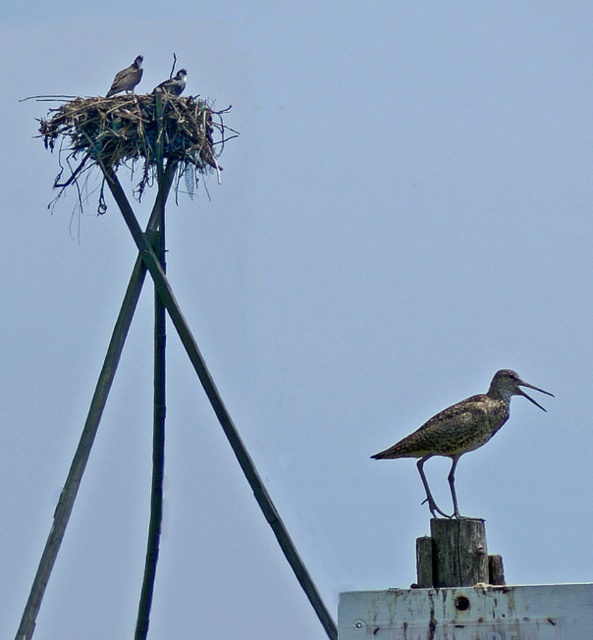
Can you confirm if speckled feathered bird at center is thinner than dark gray feathers at upper left?

Incorrect, speckled feathered bird at center's width is not less than dark gray feathers at upper left's.

Does point (419, 448) come behind point (178, 80)?

That is False.

Where is `speckled feathered bird at center`? This screenshot has width=593, height=640. speckled feathered bird at center is located at coordinates (460, 429).

Is speckled feathered bird at center smaller than brown speckled bird at upper left?

No.

Who is taller, speckled feathered bird at center or brown speckled bird at upper left?

speckled feathered bird at center is taller.

Which is in front, point (502, 378) or point (132, 72)?

Point (502, 378) is more forward.

Locate an element on the screen. The width and height of the screenshot is (593, 640). speckled feathered bird at center is located at coordinates (460, 429).

Is point (130, 84) positioned before point (173, 92)?

No, (130, 84) is behind (173, 92).

Does point (122, 76) come closer to viewer compared to point (165, 90)?

No, it is not.

Locate an element on the screen. This screenshot has width=593, height=640. brown speckled bird at upper left is located at coordinates (126, 77).